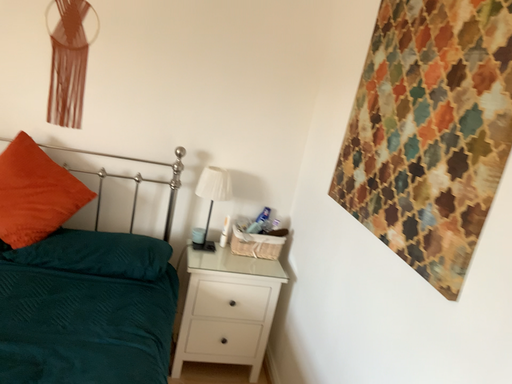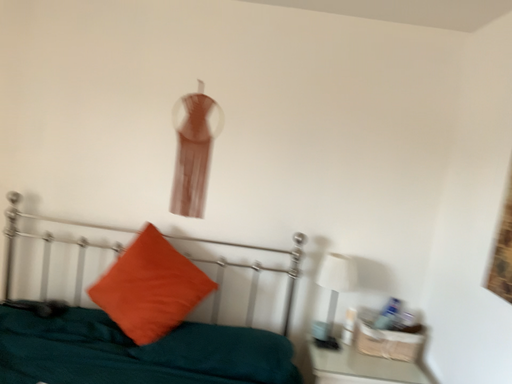
Question: Which way did the camera rotate in the video?

Choices:
 (A) rotated upward
 (B) rotated downward

Answer: (A)